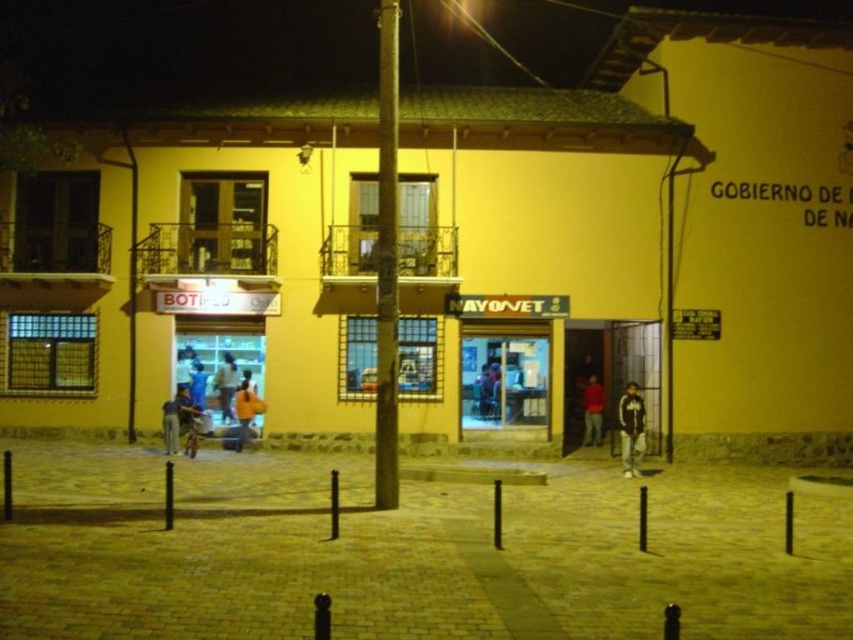
Can you confirm if yellow matte building at center is thinner than red matte shirt at center?

No, yellow matte building at center is not thinner than red matte shirt at center.

Does yellow matte building at center come behind red matte shirt at center?

No.

Which is in front, point (160, 221) or point (583, 413)?

Point (160, 221) is in front.

Locate an element on the screen. Image resolution: width=853 pixels, height=640 pixels. yellow matte building at center is located at coordinates (196, 269).

Who is taller, dark blue jacket at center or orange fabric shirt at center?

dark blue jacket at center

Between dark blue jacket at center and orange fabric shirt at center, which one appears on the right side from the viewer's perspective?

dark blue jacket at center is more to the right.

You are a GUI agent. You are given a task and a screenshot of the screen. Output one action in this format:
    pyautogui.click(x=<x>, y=<y>)
    Task: Click on the dark blue jacket at center
    
    Given the screenshot: What is the action you would take?
    pyautogui.click(x=631, y=428)

In order to click on dark blue jacket at center in this screenshot , I will do `click(631, 428)`.

Is smooth brown pole at center positioned in front of red matte shirt at center?

Yes, it is.

Is smooth brown pole at center bigger than red matte shirt at center?

Correct, smooth brown pole at center is larger in size than red matte shirt at center.

Between point (386, 321) and point (593, 380), which one is positioned behind?

The point (593, 380) is more distant.

At what (x,y) coordinates should I click in order to perform the action: click on smooth brown pole at center. Please return your answer as a coordinate pair (x, y). Looking at the image, I should click on (386, 260).